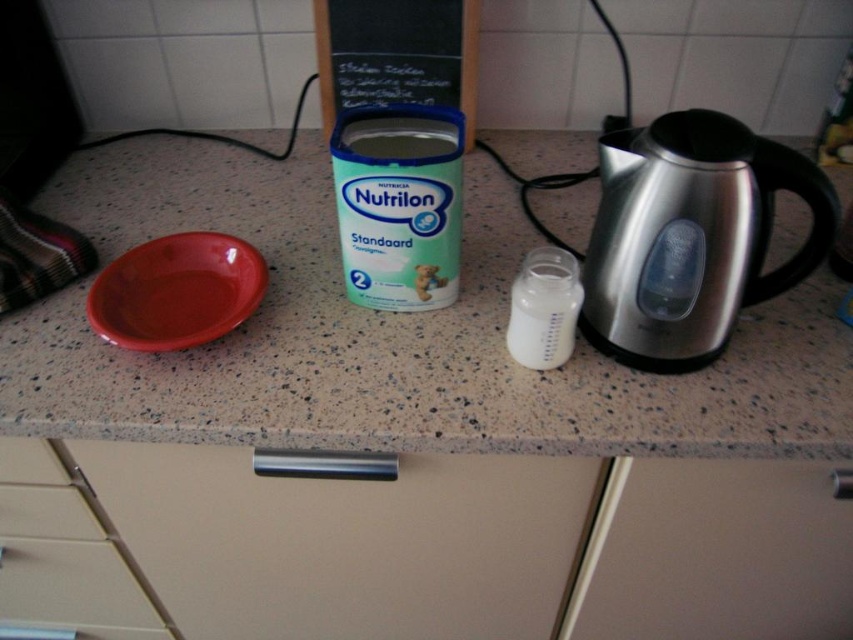
You are organizing items on the speckled granite countertop at center and the matte plastic bowl at left. Which object is positioned higher from the ground?

The speckled granite countertop at center is located above the matte plastic bowl at left, so it is higher from the ground.

You are standing at the kitchen counter and want to reach two points on the countertop. The first point is at coordinates point (x=642, y=156) and the second point is at point (x=444, y=188). Which point is closer to you?

Point (x=642, y=156) is closer to the viewer than point (x=444, y=188).